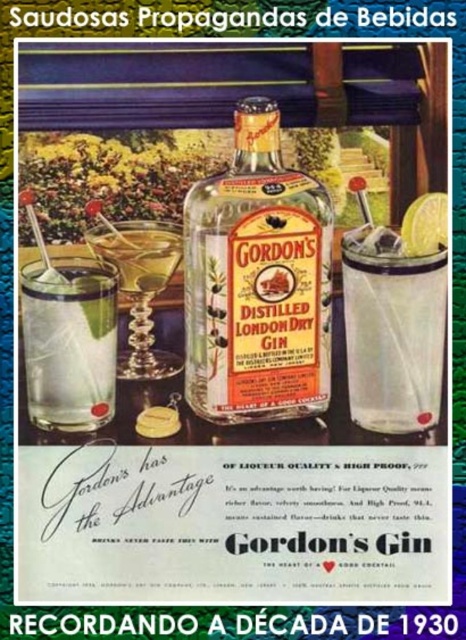
You are an art curator arranging a 1930s themed exhibition. You need to place a small label next to the translucent glass bottle at center and the yellow matte lime at upper right. Based on their positions in the advertisement, which object should the label be placed to the right of?

The label should be placed to the right of the translucent glass bottle at center because it is positioned to the left of the yellow matte lime at upper right, meaning the lime is to its right.

Looking at this image, you are an art conservator examining this vintage advertisement. You notice two points marked on the image at coordinates point (290, 397) and point (430, 232). Which of these points is closer to the camera lens?

Point (290, 397) is further to the camera than point (430, 232). Therefore, point (430, 232) is closer to the camera lens.